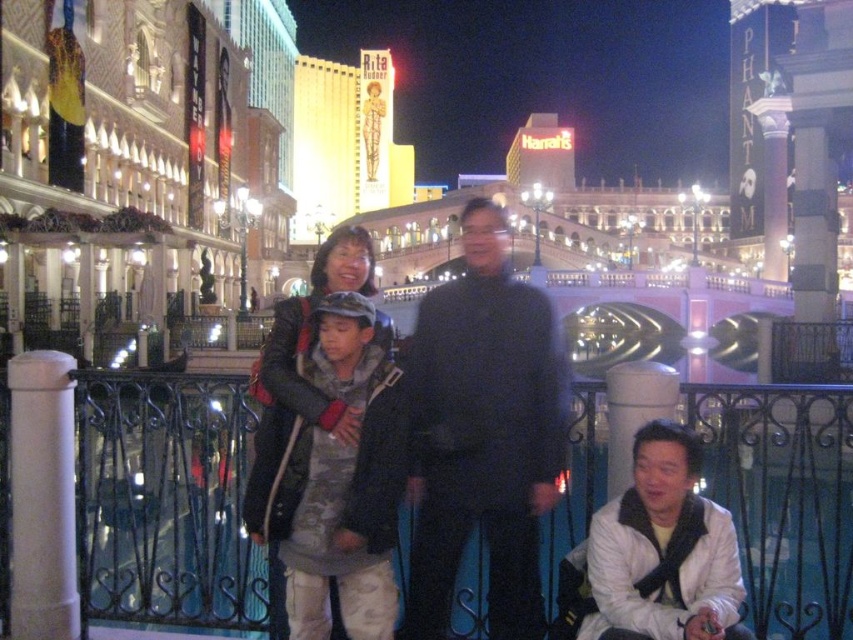
You are a photographer standing at the edge of the Las Vegas strip, near the black metal railing. You want to take a photo of the iconic signage in the background and include both the white matte jacket at lower right and the leather jacket at center in the frame. Given their distance apart, will you be able to fit both into the same photo without moving your position?

The white matte jacket at lower right is 15.84 meters away from the leather jacket at center. Since the distance between them is quite large, it might be challenging to capture both in the same frame without adjusting your position or using a wide angle lens. However, depending on the camera settings and lens used, it could be possible to include both in the photo.

You are a photographer trying to capture a group photo of the two adults and two children. You notice the white matte jacket at lower right and the leather jacket at center in the scene. Which adult is standing to the right of the other?

The white matte jacket at lower right is positioned on the right side of leather jacket at center, so the adult wearing the white matte jacket at lower right is standing to the right of the adult wearing the leather jacket at center.